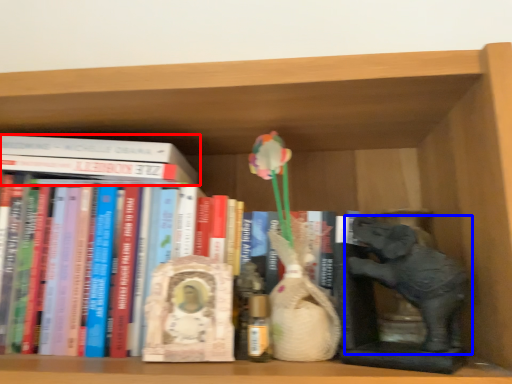
Question: Which point is closer to the camera, book (highlighted by a red box) or elephant (highlighted by a blue box)?

Choices:
 (A) book
 (B) elephant

Answer: (B)